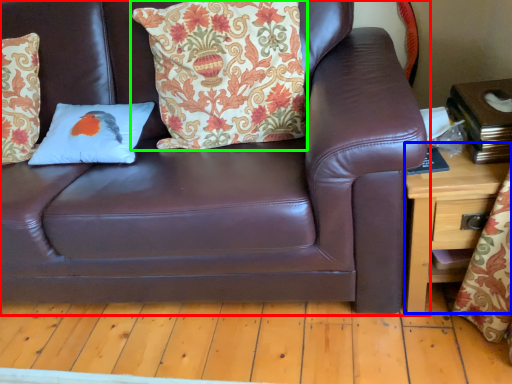
Question: Estimate the real-world distances between objects in this image. Which object is closer to studio couch (highlighted by a red box), table (highlighted by a blue box) or pillow (highlighted by a green box)?

Choices:
 (A) table
 (B) pillow

Answer: (B)